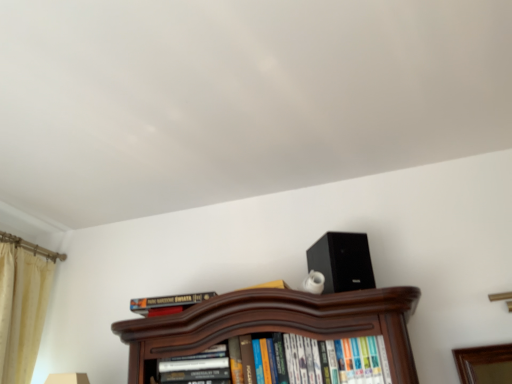
Question: Is beige velvet curtain at left closer to the viewer compared to black matte speaker at upper right?

Choices:
 (A) no
 (B) yes

Answer: (A)

Question: Can you confirm if beige velvet curtain at left is bigger than black matte speaker at upper right?

Choices:
 (A) yes
 (B) no

Answer: (A)

Question: Is beige velvet curtain at left further to camera compared to black matte speaker at upper right?

Choices:
 (A) yes
 (B) no

Answer: (A)

Question: Is beige velvet curtain at left taller than black matte speaker at upper right?

Choices:
 (A) yes
 (B) no

Answer: (A)

Question: From a real-world perspective, is beige velvet curtain at left over black matte speaker at upper right?

Choices:
 (A) no
 (B) yes

Answer: (A)

Question: From their relative heights in the image, would you say hardcover book at center, marked as the 1th book in a left-to-right arrangement, is taller or shorter than beige velvet curtain at left?

Choices:
 (A) short
 (B) tall

Answer: (A)

Question: Considering the positions of hardcover book at center, arranged as the third book when viewed from the right, and beige velvet curtain at left in the image, is hardcover book at center, arranged as the third book when viewed from the right, bigger or smaller than beige velvet curtain at left?

Choices:
 (A) small
 (B) big

Answer: (A)

Question: Which is correct: hardcover book at center, marked as the 1th book in a left-to-right arrangement, is inside beige velvet curtain at left, or outside of it?

Choices:
 (A) inside
 (B) outside

Answer: (B)

Question: From the image's perspective, is hardcover book at center, arranged as the third book when viewed from the right, above or below beige velvet curtain at left?

Choices:
 (A) above
 (B) below

Answer: (A)

Question: From the image's perspective, is black matte speaker at upper right positioned above or below hardcover book at center, positioned as the 2th book in left-to-right order?

Choices:
 (A) above
 (B) below

Answer: (A)

Question: Looking at their shapes, would you say black matte speaker at upper right is wider or thinner than hardcover book at center, positioned as the 2th book in left-to-right order?

Choices:
 (A) wide
 (B) thin

Answer: (A)

Question: Considering the relative positions of black matte speaker at upper right and hardcover book at center, positioned as the 2th book in left-to-right order, in the image provided, is black matte speaker at upper right to the left or to the right of hardcover book at center, positioned as the 2th book in left-to-right order,?

Choices:
 (A) right
 (B) left

Answer: (A)

Question: Is black matte speaker at upper right taller or shorter than hardcover book at center, positioned as the 2th book in left-to-right order?

Choices:
 (A) short
 (B) tall

Answer: (B)

Question: Based on their sizes in the image, would you say hardcover book at center, arranged as the third book when viewed from the right, is bigger or smaller than hardcover books at center, the 1th book from the right?

Choices:
 (A) small
 (B) big

Answer: (A)

Question: Looking at their shapes, would you say hardcover book at center, marked as the 1th book in a left-to-right arrangement, is wider or thinner than hardcover books at center, which ranks as the third book in left-to-right order?

Choices:
 (A) wide
 (B) thin

Answer: (B)